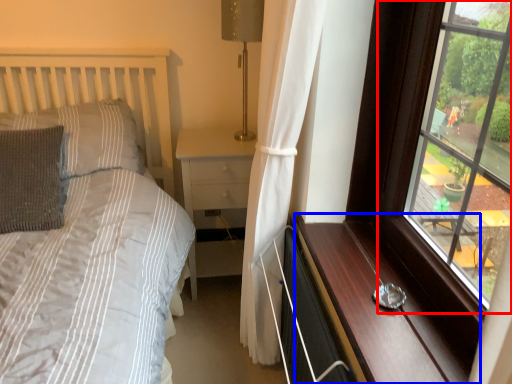
Question: Which of the following is the closest to the observer, window (highlighted by a red box) or dresser (highlighted by a blue box)?

Choices:
 (A) window
 (B) dresser

Answer: (A)